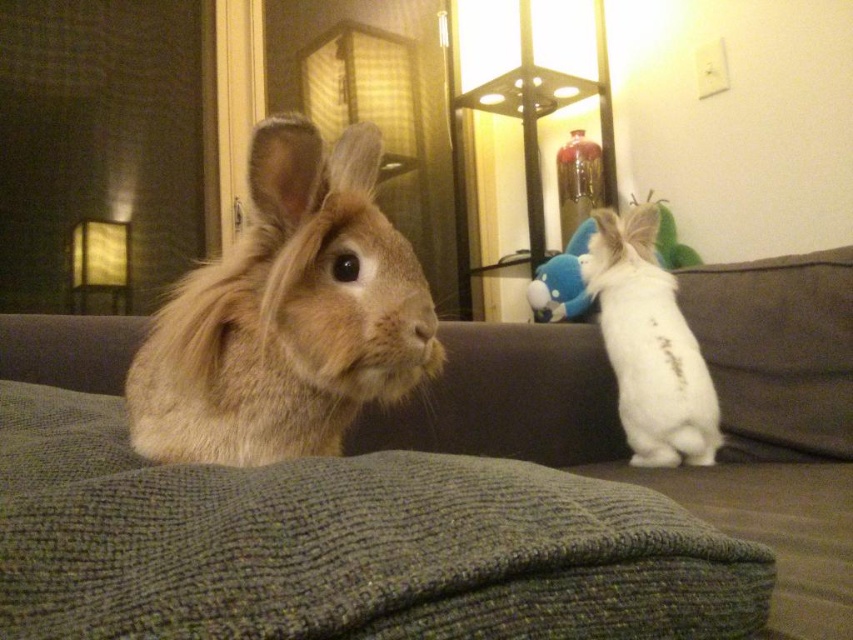
You are a photographer trying to capture both the fuzzy beige rabbit at left and the blue plush toy at right in a single shot. Since the camera can only focus on objects at a certain distance, will you need to adjust the focus to include both?

The fuzzy beige rabbit at left is closer to the viewer than the blue plush toy at right. Since they are at different distances, you will need to adjust the focus to ensure both are in clear view.

You are standing in the room and want to place a small basket on the green knitted couch at center. Based on the coordinates provided, where exactly should you place the basket?

The green knitted couch at center is located at point (721,417), so you should place the basket at those coordinates to ensure it is centered on the couch.